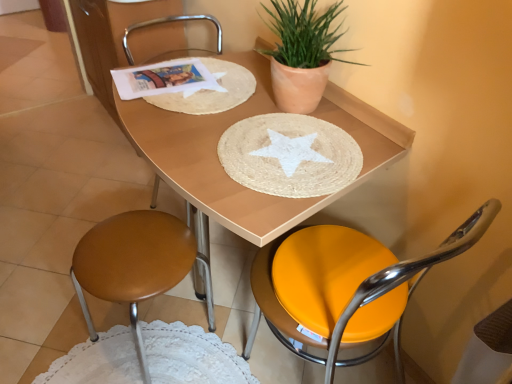
This screenshot has height=384, width=512. Find the location of `free space that is to the left of metallic silver chair at center, the second chair in the right-to-left sequence`. free space that is to the left of metallic silver chair at center, the second chair in the right-to-left sequence is located at coordinates (123, 195).